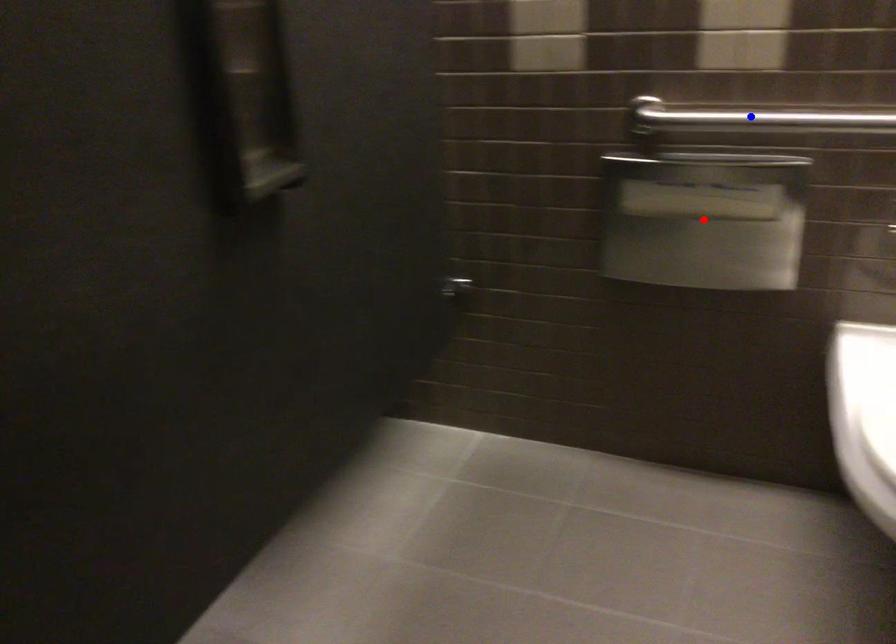
Question: Which of the two points in the image is closer to the camera?

Choices:
 (A) Blue point is closer.
 (B) Red point is closer.

Answer: (A)